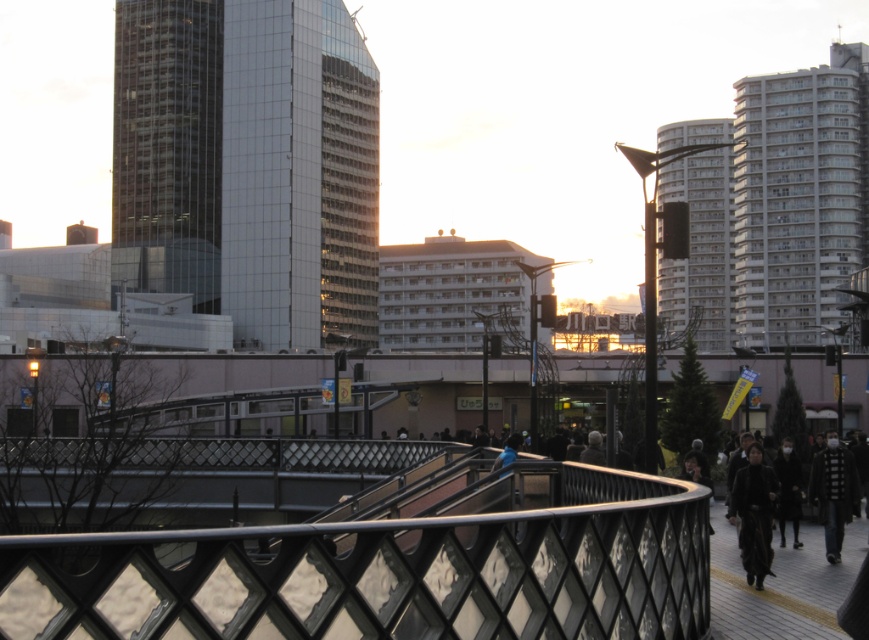
Question: Can you confirm if black fur coat at lower right is wider than black matte coat at lower right?

Choices:
 (A) yes
 (B) no

Answer: (B)

Question: Which object is positioned closest to the black fur coat at lower right?

Choices:
 (A) black textured jacket at lower right
 (B) metallic mesh bridge at center

Answer: (A)

Question: Where is metallic mesh bridge at center located in relation to black matte coat at lower right in the image?

Choices:
 (A) left
 (B) right

Answer: (A)

Question: Which is farther from the black fur coat at lower right?

Choices:
 (A) black matte coat at lower right
 (B) black textured jacket at lower right
 (C) blue fabric at center

Answer: (C)

Question: Among these objects, which one is farthest from the camera?

Choices:
 (A) metallic mesh bridge at center
 (B) blue fabric at center
 (C) black fur coat at lower right
 (D) black matte coat at lower right

Answer: (D)

Question: Is black matte coat at lower right thinner than blue fabric at center?

Choices:
 (A) no
 (B) yes

Answer: (B)